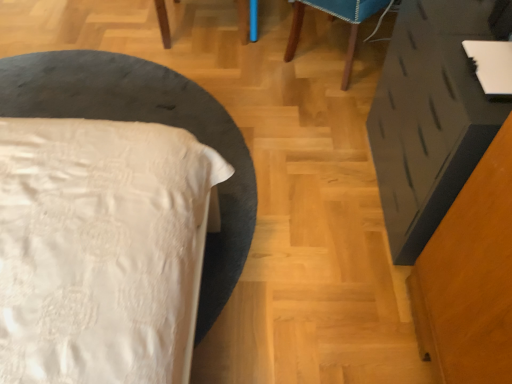
Question: Is white satin bed at left to the left or to the right of wooden chair at upper center in the image?

Choices:
 (A) left
 (B) right

Answer: (A)

Question: From a real-world perspective, is white satin bed at left above or below wooden chair at upper center?

Choices:
 (A) above
 (B) below

Answer: (B)

Question: Which object is the farthest from the wooden chair at upper center?

Choices:
 (A) matte black vanity at right
 (B) white satin bed at left

Answer: (B)

Question: Which is farther from the wooden chair at upper center?

Choices:
 (A) matte black vanity at right
 (B) white satin bed at left

Answer: (B)